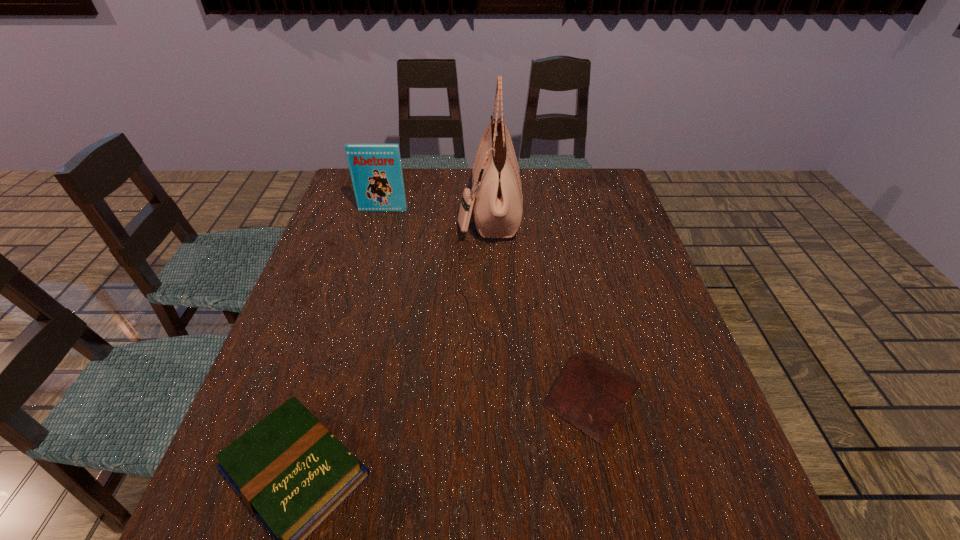
Locate an element on the screen. handbag is located at coordinates (497, 201).

Where is `the farthest book`? Image resolution: width=960 pixels, height=540 pixels. the farthest book is located at coordinates (376, 171).

Find the location of a particular element. The width and height of the screenshot is (960, 540). the tallest book is located at coordinates (376, 171).

Find the location of a particular element. The image size is (960, 540). the rightmost book is located at coordinates (588, 393).

Where is `blank area located on the side of the handbag with the attached pouch`? The image size is (960, 540). blank area located on the side of the handbag with the attached pouch is located at coordinates (350, 211).

You are a GUI agent. You are given a task and a screenshot of the screen. Output one action in this format:
    pyautogui.click(x=<x>, y=<y>)
    Task: Click on the free space located 0.050m on the side of the handbag with the attached pouch
    
    Given the screenshot: What is the action you would take?
    pyautogui.click(x=443, y=211)

You are a GUI agent. You are given a task and a screenshot of the screen. Output one action in this format:
    pyautogui.click(x=<x>, y=<y>)
    Task: Click on the vacant point located 0.140m on the side of the handbag with the attached pouch
    The image size is (960, 540).
    Given the screenshot: What is the action you would take?
    pyautogui.click(x=414, y=211)

At what (x,y) coordinates should I click in order to perform the action: click on free region located on the front cover of the second tallest object. Please return your answer as a coordinate pair (x, y). The image size is (960, 540). Looking at the image, I should click on (366, 272).

At what (x,y) coordinates should I click in order to perform the action: click on vacant space situated 0.090m on the right of the rightmost book. Please return your answer as a coordinate pair (x, y). The width and height of the screenshot is (960, 540). Looking at the image, I should click on coord(688,395).

The image size is (960, 540). Find the location of `object present at the far edge`. object present at the far edge is located at coordinates pyautogui.click(x=497, y=201).